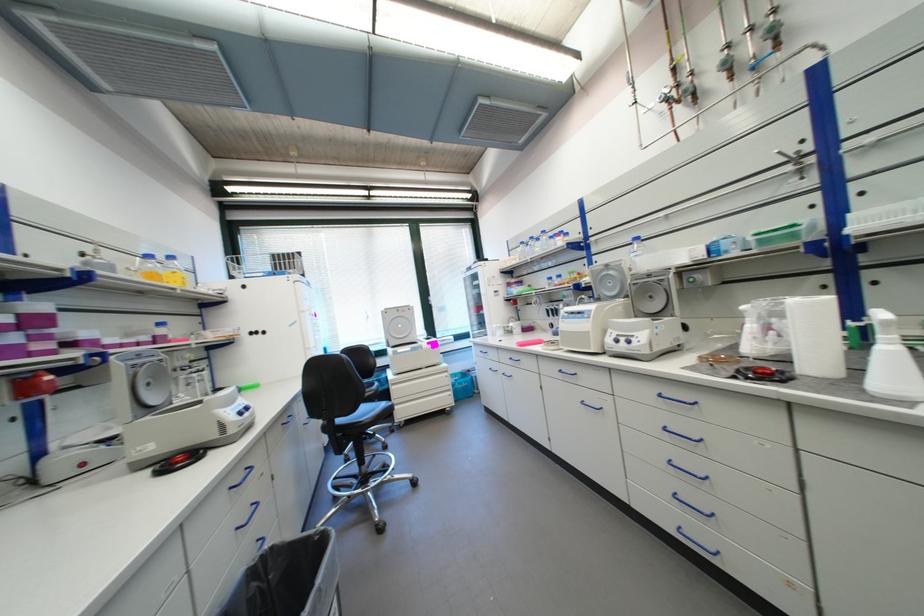
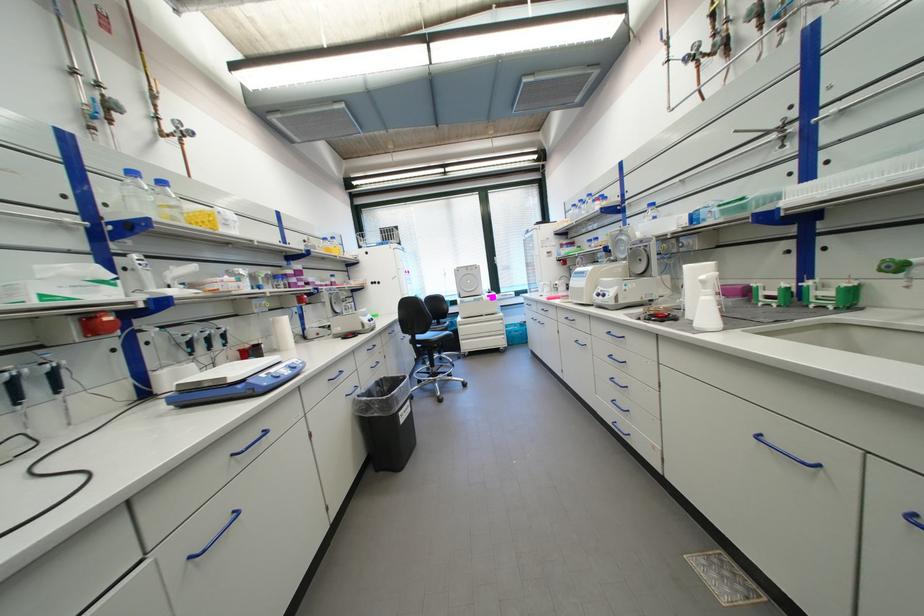
In the second image, find the point that corresponds to point (393, 313) in the first image.

(466, 272)